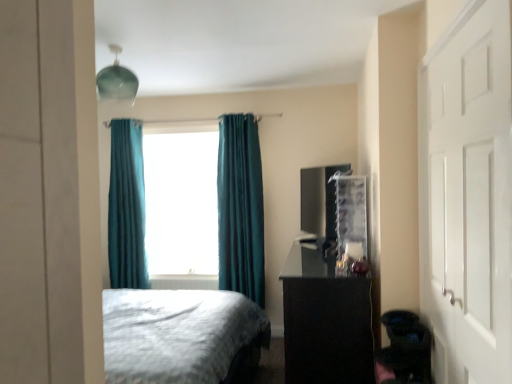
Question: From the image's perspective, relative to teal velvet curtain at center, the 1th curtain in the left-to-right sequence, is teal fabric curtain at center above or below?

Choices:
 (A) above
 (B) below

Answer: (A)

Question: Do you think teal fabric curtain at center is within teal velvet curtain at center, the 1th curtain in the left-to-right sequence, or outside of it?

Choices:
 (A) outside
 (B) inside

Answer: (A)

Question: Which object is the farthest from the teal fabric curtain at center?

Choices:
 (A) teal velvet curtain at center, the 1th curtain in the left-to-right sequence
 (B) white matte door at right
 (C) teal velvet curtain at center, which ranks as the 1th curtain in right-to-left order
 (D) black glossy vanity at right

Answer: (B)

Question: Which is nearer to the teal velvet curtain at center, the second curtain viewed from the right?

Choices:
 (A) teal fabric curtain at center
 (B) white matte door at right
 (C) teal velvet curtain at center, positioned as the 2th curtain in left-to-right order
 (D) black glossy vanity at right

Answer: (A)